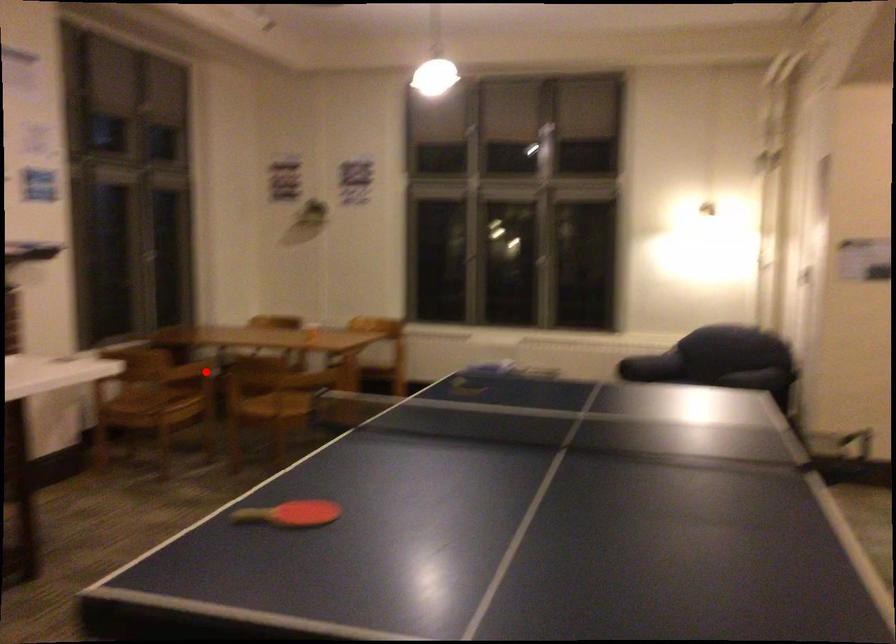
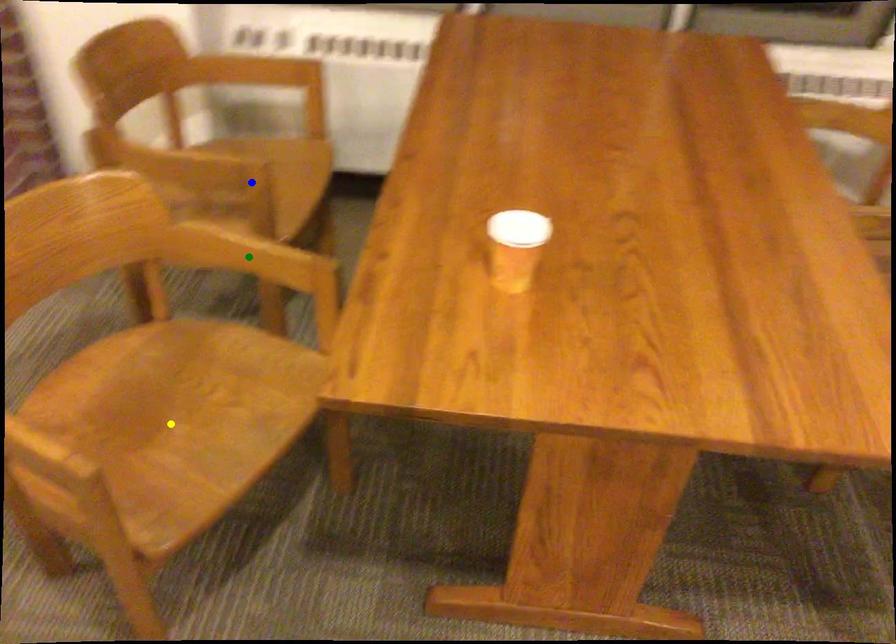
Question: I am providing you with two images of the same scene from different viewpoints. A red point is marked on the first image. You are given multiple points on the second image. Which mark in image 2 goes with the point in image 1?

Choices:
 (A) yellow point
 (B) green point
 (C) blue point

Answer: (C)